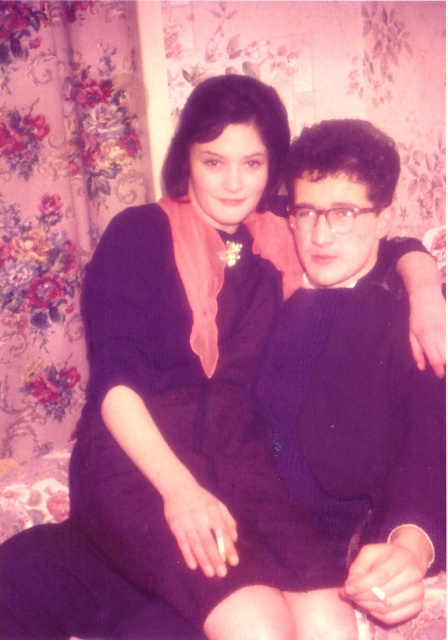
Where is the matte purple dress at center located in the image?

→ The matte purple dress at center is located at point 0.653 on the horizontal axis and 0.411 on the vertical axis.

You are a photographer adjusting your camera settings to focus on the matte purple dress at center and the purple knitted sweater at center. Which object should you focus on first to ensure proper depth of field?

The matte purple dress at center is closer to the viewer than the purple knitted sweater at center, so you should focus on the matte purple dress at center first to ensure proper depth of field.

You are a photographer setting up a photoshoot. You have two purple items in the scene, a matte purple dress at center and a purple knitted sweater at center. Which item takes up more space in the frame?

The matte purple dress at center has a larger size compared to the purple knitted sweater at center, so the matte purple dress at center takes up more space in the frame.